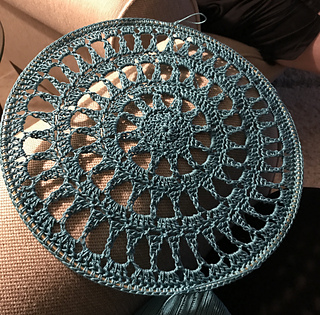
Image resolution: width=320 pixels, height=315 pixels. Identify the location of couch arm. (31, 272).